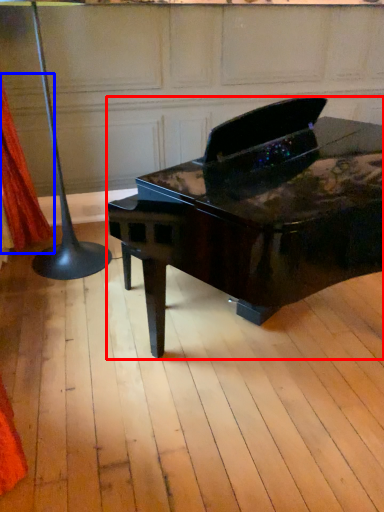
Question: Which object is closer to the camera taking this photo, piano (highlighted by a red box) or curtain (highlighted by a blue box)?

Choices:
 (A) piano
 (B) curtain

Answer: (A)